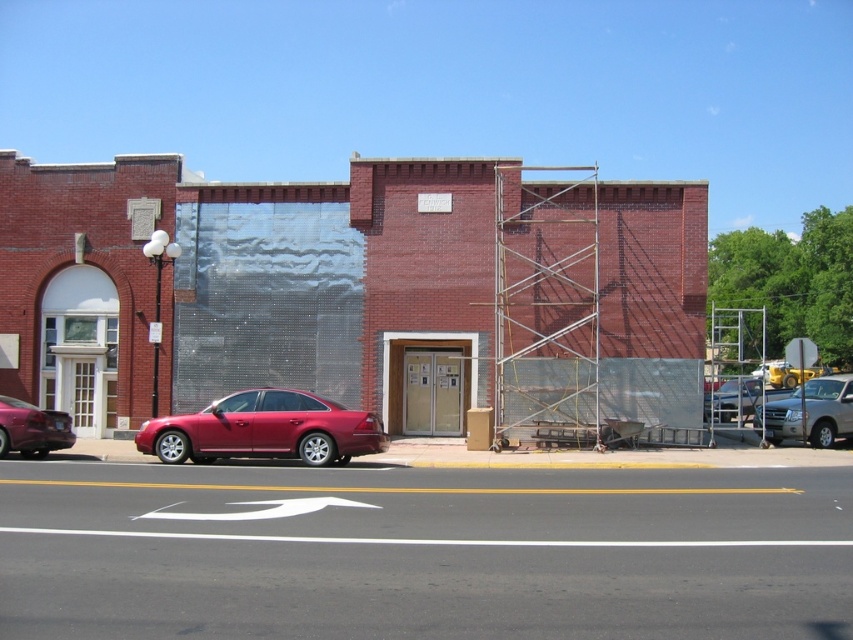
Question: Which object is positioned closest to the shiny red sedan at lower left?

Choices:
 (A) metallic silver truck at center
 (B) matte red sedan at center

Answer: (B)

Question: Which object is positioned closest to the shiny red sedan at lower left?

Choices:
 (A) brick building at center
 (B) metallic silver truck at center

Answer: (A)

Question: Can you confirm if shiny red sedan at lower left is smaller than metallic silver sedan at right?

Choices:
 (A) no
 (B) yes

Answer: (B)

Question: Is metallic scaffolding at right thinner than metallic silver sedan at right?

Choices:
 (A) yes
 (B) no

Answer: (B)

Question: Can you confirm if metallic silver truck at center is wider than metallic silver sedan at right?

Choices:
 (A) yes
 (B) no

Answer: (B)

Question: Among these points, which one is nearest to the camera?

Choices:
 (A) (709, 419)
 (B) (20, 433)
 (C) (534, 273)

Answer: (B)